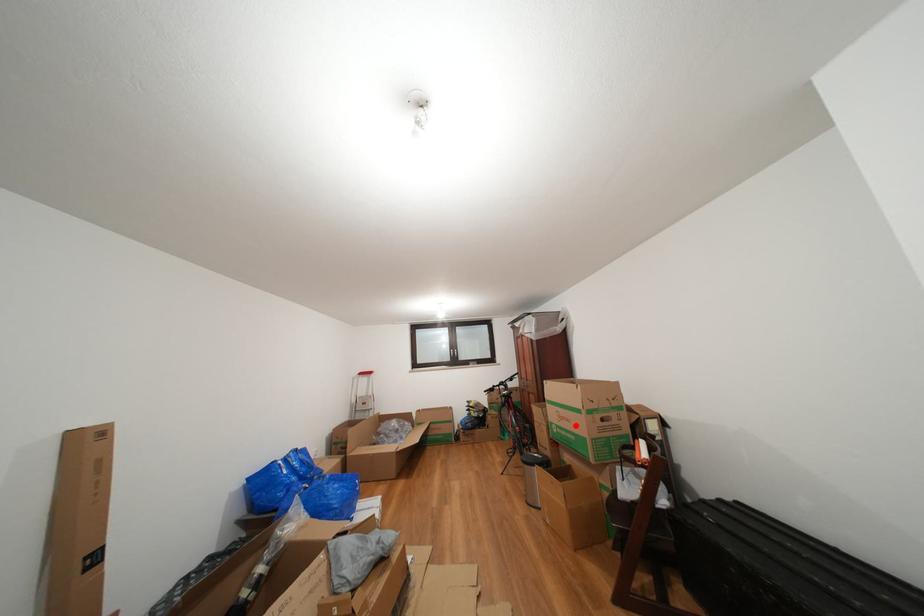
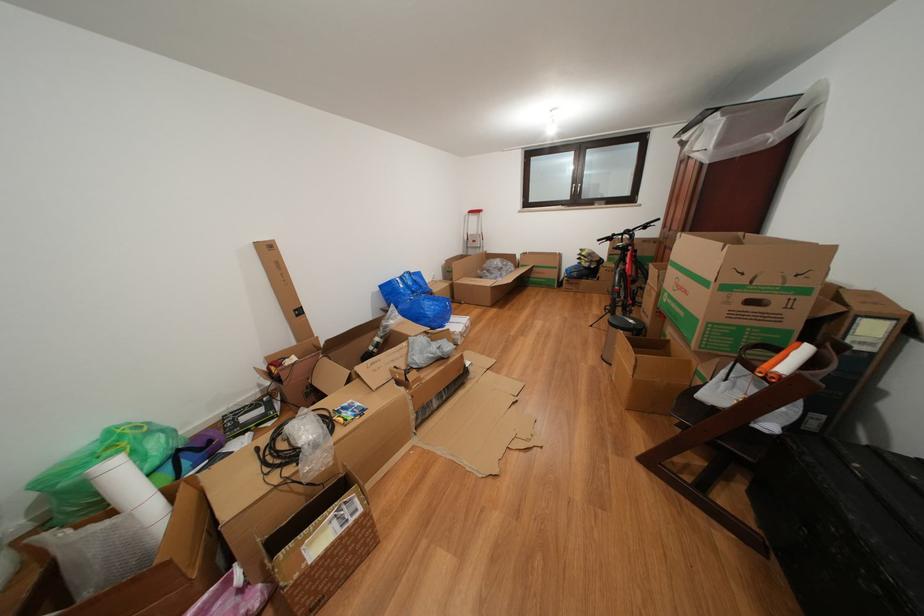
Question: I am providing you with two images of the same scene from different viewpoints. A red point is shown in image1. For the corresponding object point in image2, is it positioned nearer or farther from the camera?

Choices:
 (A) Nearer
 (B) Farther

Answer: (A)